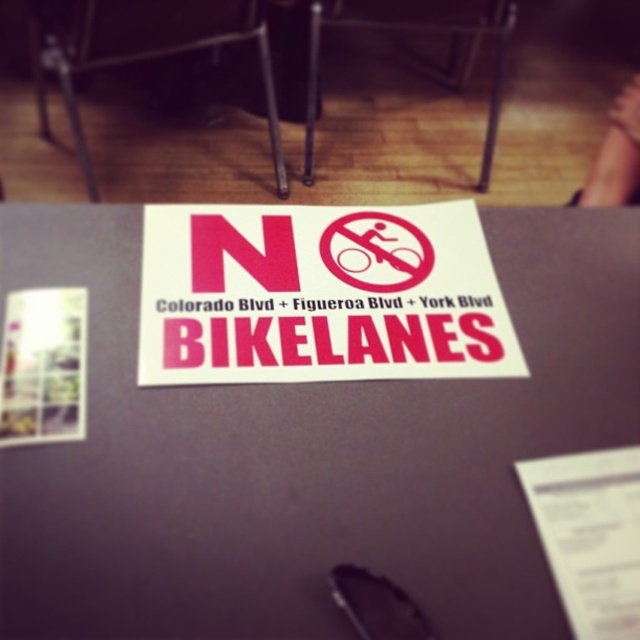
Is point (17, 620) positioned before point (365, 275)?

Yes, it is.

Based on the photo, can you confirm if purple matte paper at center is positioned to the right of matte red sign at center?

Correct, you'll find purple matte paper at center to the right of matte red sign at center.

Is point (333, 614) positioned in front of point (349, 360)?

Yes, it is.

Where is `purple matte paper at center`? This screenshot has height=640, width=640. purple matte paper at center is located at coordinates (308, 454).